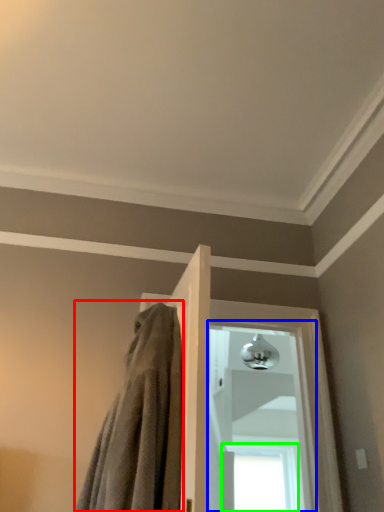
Question: Estimate the real-world distances between objects in this image. Which object is closer to bath towel (highlighted by a red box), window (highlighted by a blue box) or window (highlighted by a green box)?

Choices:
 (A) window
 (B) window

Answer: (A)